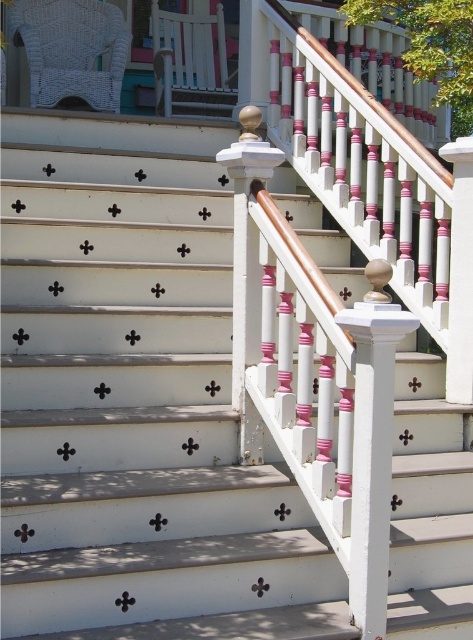
Question: Which of the following is the closest to the observer?

Choices:
 (A) (52, 90)
 (B) (190, 108)

Answer: (A)

Question: Which object is closer to the camera taking this photo?

Choices:
 (A) white wicker rocking chair at upper left
 (B) white painted wood balustrade at upper center

Answer: (A)

Question: Does white wicker rocking chair at upper left have a smaller size compared to white painted wood balustrade at upper center?

Choices:
 (A) yes
 (B) no

Answer: (A)

Question: Does white wicker rocking chair at upper left appear on the right side of white painted wood balustrade at upper center?

Choices:
 (A) no
 (B) yes

Answer: (A)

Question: Is white wicker rocking chair at upper left positioned at the back of white painted wood balustrade at upper center?

Choices:
 (A) yes
 (B) no

Answer: (B)